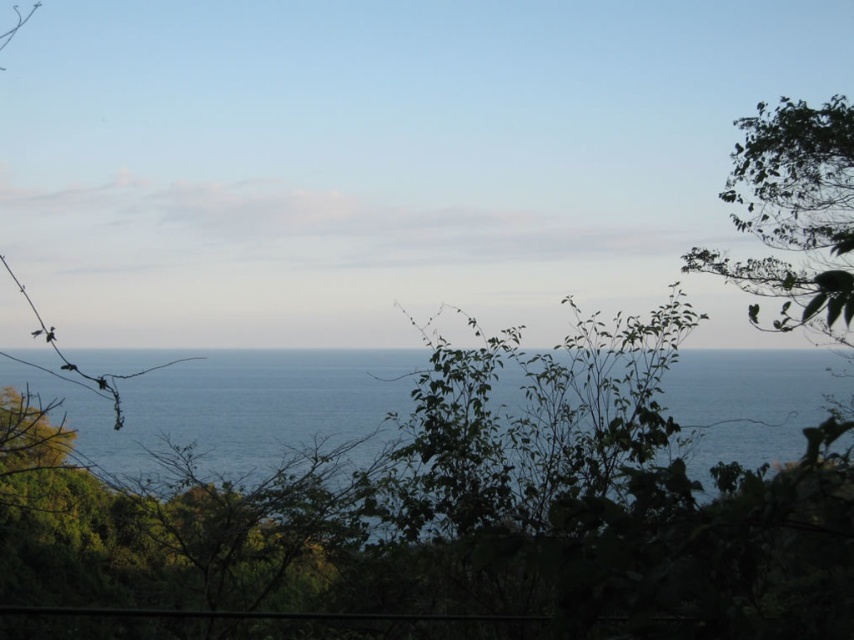
Question: Considering the relative positions of blue water at center and green leafy tree at upper right in the image provided, where is blue water at center located with respect to green leafy tree at upper right?

Choices:
 (A) above
 (B) below

Answer: (B)

Question: Does blue water at center have a greater width compared to green leafy tree at upper right?

Choices:
 (A) no
 (B) yes

Answer: (B)

Question: Which point appears closest to the camera in this image?

Choices:
 (A) (778, 122)
 (B) (758, 384)

Answer: (A)

Question: Which object is closer to the camera taking this photo?

Choices:
 (A) blue water at center
 (B) green leafy tree at upper right

Answer: (B)

Question: Can you confirm if blue water at center is wider than green leafy tree at upper right?

Choices:
 (A) no
 (B) yes

Answer: (B)